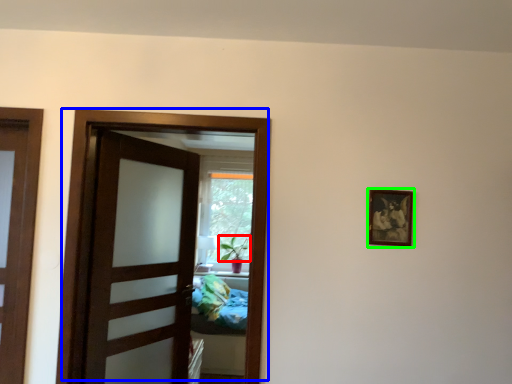
Question: Which is farther away from plant (highlighted by a red box)? door (highlighted by a blue box) or picture frame (highlighted by a green box)?

Choices:
 (A) door
 (B) picture frame

Answer: (B)